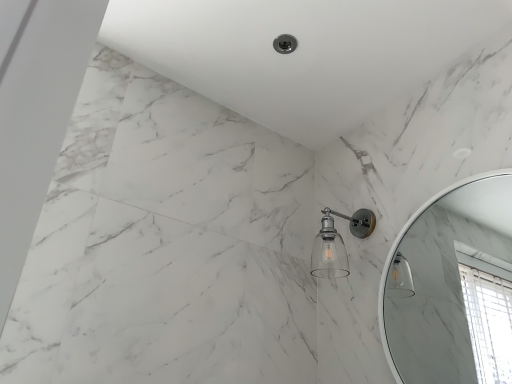
Question: In the image, is white glossy mirror at upper right on the left side or the right side of clear glass shower head at center?

Choices:
 (A) left
 (B) right

Answer: (B)

Question: Relative to clear glass shower head at center, is white glossy mirror at upper right in front or behind?

Choices:
 (A) front
 (B) behind

Answer: (A)

Question: In terms of width, does white glossy mirror at upper right look wider or thinner when compared to clear glass shower head at center?

Choices:
 (A) thin
 (B) wide

Answer: (A)

Question: Relative to white glossy mirror at upper right, is clear glass shower head at center in front or behind?

Choices:
 (A) behind
 (B) front

Answer: (A)

Question: Visually, is clear glass shower head at center positioned to the left or to the right of white glossy mirror at upper right?

Choices:
 (A) left
 (B) right

Answer: (A)

Question: Considering the positions of point (321, 261) and point (471, 284), is point (321, 261) closer or farther from the camera than point (471, 284)?

Choices:
 (A) closer
 (B) farther

Answer: (A)

Question: Is clear glass shower head at center wider or thinner than white glossy mirror at upper right?

Choices:
 (A) thin
 (B) wide

Answer: (B)